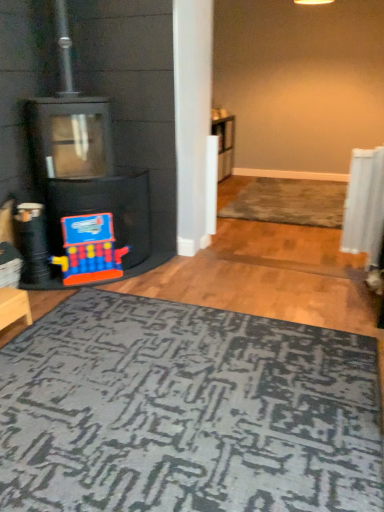
Question: Is wooden stool at lower left behind rug with textured pattern at center?

Choices:
 (A) yes
 (B) no

Answer: (B)

Question: From a real-world perspective, does wooden stool at lower left stand above rug with textured pattern at center?

Choices:
 (A) yes
 (B) no

Answer: (A)

Question: Can you confirm if wooden stool at lower left is taller than rug with textured pattern at center?

Choices:
 (A) no
 (B) yes

Answer: (B)

Question: Does wooden stool at lower left have a lesser height compared to rug with textured pattern at center?

Choices:
 (A) yes
 (B) no

Answer: (B)

Question: Is wooden stool at lower left positioned beyond the bounds of rug with textured pattern at center?

Choices:
 (A) no
 (B) yes

Answer: (B)

Question: Is rug with textured pattern at center a part of wooden stool at lower left?

Choices:
 (A) yes
 (B) no

Answer: (B)

Question: Does wooden stool at lower left have a larger size compared to black matte fireplace at left?

Choices:
 (A) no
 (B) yes

Answer: (A)

Question: Is wooden stool at lower left located outside black matte fireplace at left?

Choices:
 (A) no
 (B) yes

Answer: (B)

Question: Is wooden stool at lower left oriented towards black matte fireplace at left?

Choices:
 (A) no
 (B) yes

Answer: (A)

Question: Are wooden stool at lower left and black matte fireplace at left making contact?

Choices:
 (A) yes
 (B) no

Answer: (B)

Question: Does wooden stool at lower left have a greater width compared to black matte fireplace at left?

Choices:
 (A) yes
 (B) no

Answer: (B)

Question: Can you confirm if wooden stool at lower left is shorter than black matte fireplace at left?

Choices:
 (A) yes
 (B) no

Answer: (A)

Question: Does wooden stool at lower left touch dark gray textured rug at lower center?

Choices:
 (A) no
 (B) yes

Answer: (A)